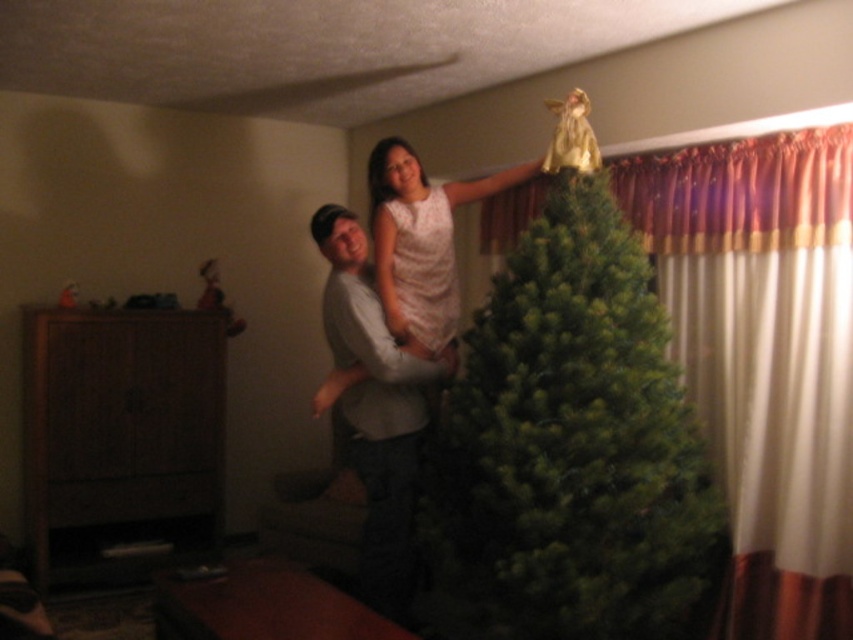
Between gray cotton shirt at center and white lace dress at center, which one is positioned lower?

gray cotton shirt at center

Find the location of a particular element. The image size is (853, 640). gray cotton shirt at center is located at coordinates (374, 410).

Does green matte christmas tree at center have a greater width compared to white lace dress at center?

Indeed, green matte christmas tree at center has a greater width compared to white lace dress at center.

Who is more forward, (573, 436) or (407, 250)?

Point (573, 436)

Locate an element on the screen. The width and height of the screenshot is (853, 640). green matte christmas tree at center is located at coordinates (573, 435).

Can you confirm if green matte christmas tree at center is taller than gray cotton shirt at center?

Yes.

Consider the image. Measure the distance between green matte christmas tree at center and gray cotton shirt at center.

The distance of green matte christmas tree at center from gray cotton shirt at center is 50.11 centimeters.

The width and height of the screenshot is (853, 640). Describe the element at coordinates (573, 435) in the screenshot. I see `green matte christmas tree at center` at that location.

Find the location of a particular element. The width and height of the screenshot is (853, 640). green matte christmas tree at center is located at coordinates (573, 435).